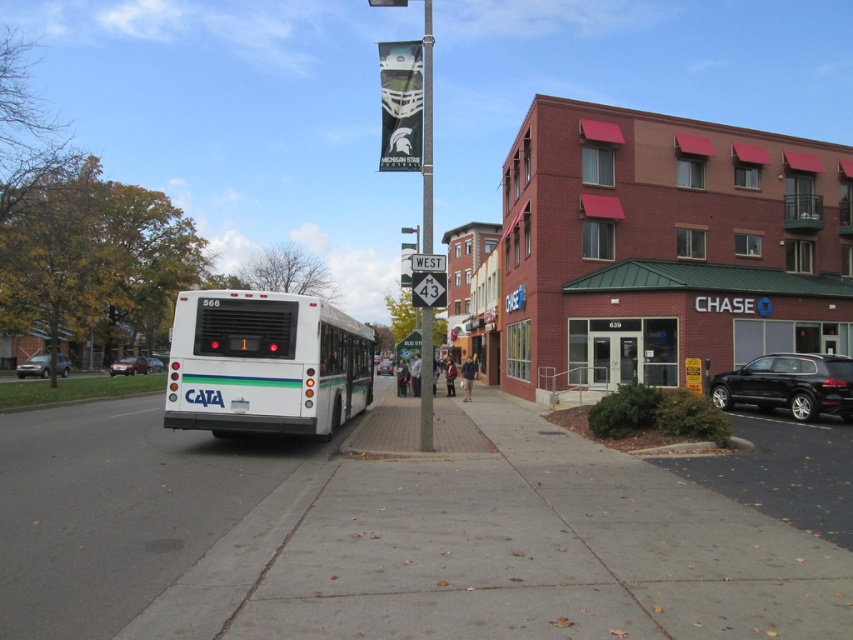
Question: Does white matte bus at center have a lesser width compared to metallic silver sedan at center?

Choices:
 (A) no
 (B) yes

Answer: (A)

Question: Which object is the closest to the metallic pole at center?

Choices:
 (A) shiny black suv at right
 (B) white matte bus at center

Answer: (B)

Question: Does shiny black suv at right appear under silver metallic sedan at lower left?

Choices:
 (A) no
 (B) yes

Answer: (A)

Question: Estimate the real-world distances between objects in this image. Which object is closer to the silver metallic sedan at lower left?

Choices:
 (A) gray concrete sidewalk at center
 (B) shiny black suv at right

Answer: (A)

Question: Is shiny black suv at right closer to camera compared to metallic silver sedan at center?

Choices:
 (A) no
 (B) yes

Answer: (B)

Question: Which of the following is the closest to the observer?

Choices:
 (A) gray concrete sidewalk at center
 (B) silver metallic sedan at lower left
 (C) white matte bus at center

Answer: (A)